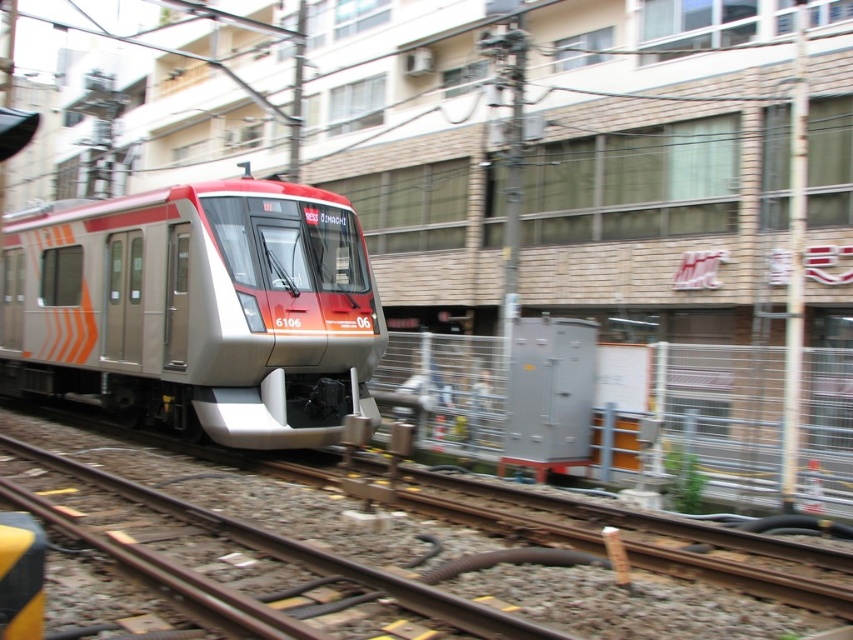
Based on the scene description, where is the metallic silver train at center located in the image?

The metallic silver train at center is located at point [196,308].